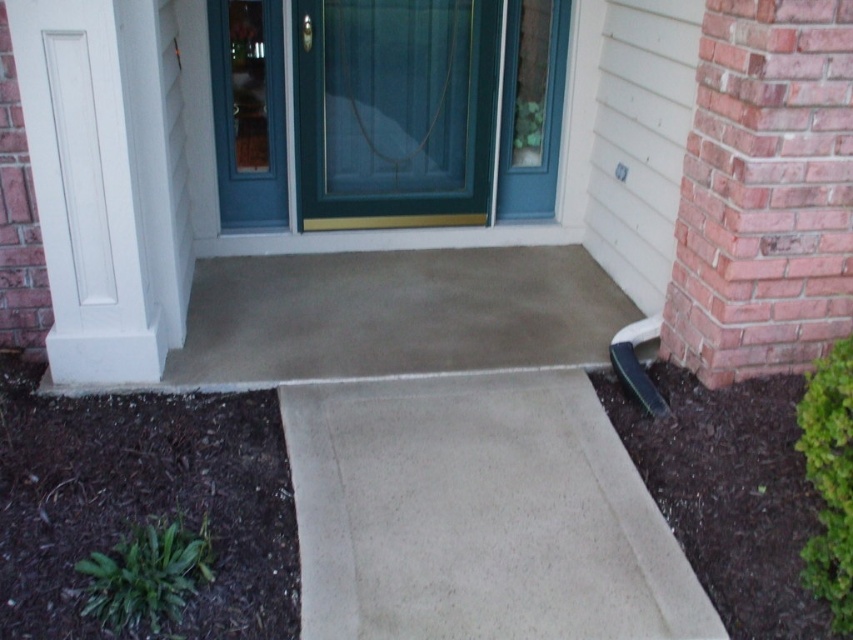
You are a delivery person approaching the entrance of the building. You need to deliver a package to the apartment behind the green glass screen door at center and the white smooth column at left. Which object should you approach first to reach the correct apartment?

You should approach the green glass screen door at center first because it is positioned on the right side of the white smooth column at left, indicating it is closer to the apartment.

From the picture: You are a delivery person with a large package that is 5 feet long. You need to carry it through the entrance between the green glass screen door at center and the white smooth column at left. Can you pass through without tilting the package?

The distance between the green glass screen door at center and the white smooth column at left is 4.44 feet. Since the package is 5 feet long, it is longer than the available space, so you cannot pass through without tilting the package.

From the picture: You are standing at the entrance of the residential building and want to reach the point marked as point (78,163). If your walking distance is limited to 2 meters, can you reach it without moving further away?

The distance between you and point (78,163) is 2.44 meters, which exceeds your 2 meter limit. You cannot reach it without moving further away.